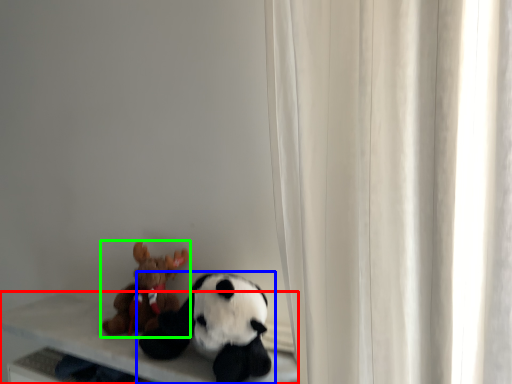
Question: Which object is positioned closest to table (highlighted by a red box)? Select from toy (highlighted by a blue box) and toy (highlighted by a green box).

Choices:
 (A) toy
 (B) toy

Answer: (B)